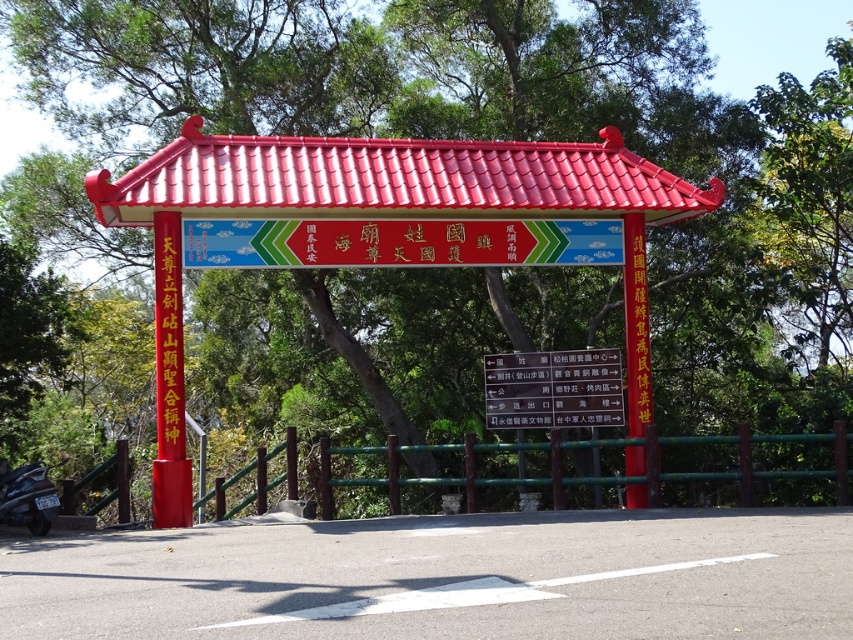
Question: Observing the image, what is the correct spatial positioning of matte red signboard at center in reference to green bamboo fence at center?

Choices:
 (A) left
 (B) right

Answer: (A)

Question: From the image, what is the correct spatial relationship of red tile roof at center in relation to black matte motorcycle at lower left?

Choices:
 (A) left
 (B) right

Answer: (B)

Question: Based on their relative distances, which object is nearer to the red tile roof at center?

Choices:
 (A) white paper sign at center
 (B) green bamboo fence at center
 (C) shiny red gazebo at center
 (D) matte red signboard at center

Answer: (D)

Question: Can you confirm if matte red signboard at center is positioned to the right of white paper sign at center?

Choices:
 (A) yes
 (B) no

Answer: (B)

Question: Among these objects, which one is nearest to the camera?

Choices:
 (A) black matte motorcycle at lower left
 (B) green bamboo fence at center
 (C) red tile roof at center
 (D) shiny red gazebo at center

Answer: (A)

Question: Considering the real-world distances, which object is closest to the black matte motorcycle at lower left?

Choices:
 (A) white paper sign at center
 (B) matte red signboard at center

Answer: (B)